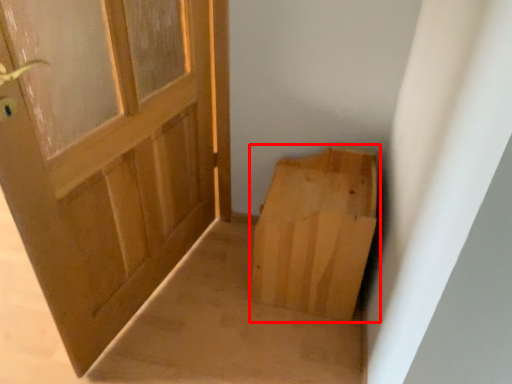
Question: Observing the image, what is the correct spatial positioning of cardboard box (annotated by the red box) in reference to door?

Choices:
 (A) right
 (B) left

Answer: (A)